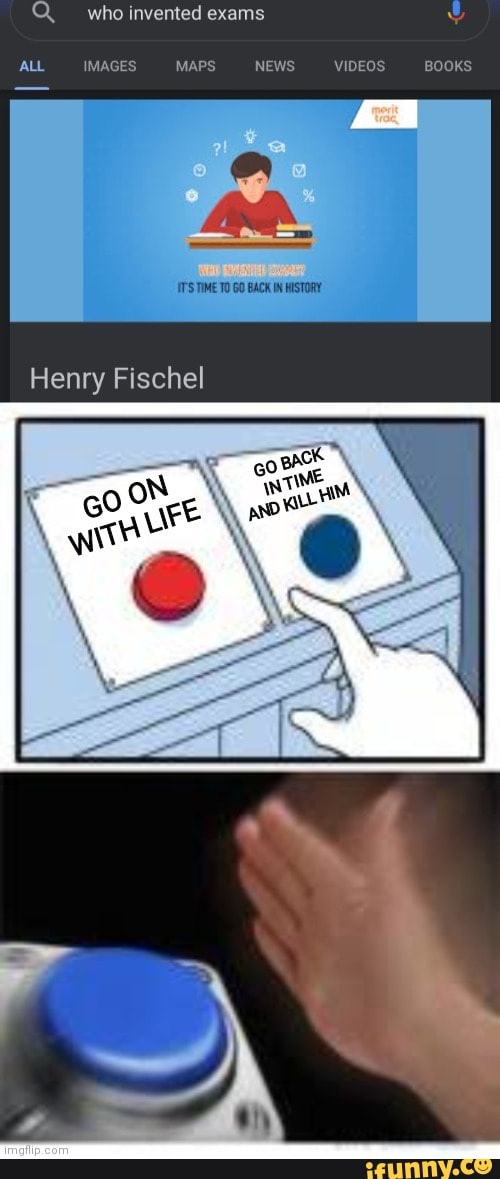
Locate an element on the screen. This screenshot has height=1179, width=500. books is located at coordinates (300, 228).